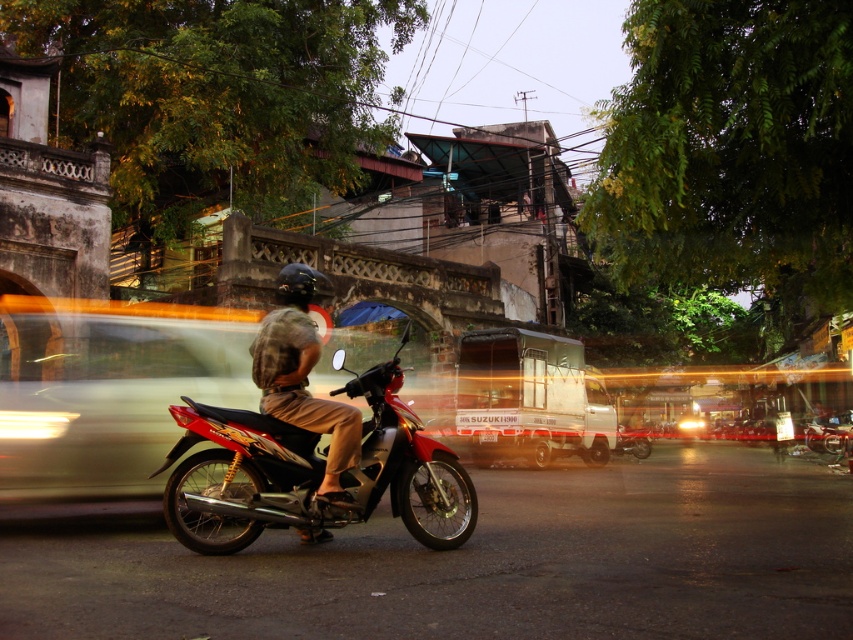
Does shiny metallic motorcycle at center appear on the left side of camouflage fabric shirt at center?

Incorrect, shiny metallic motorcycle at center is not on the left side of camouflage fabric shirt at center.

Is shiny metallic motorcycle at center shorter than camouflage fabric shirt at center?

Indeed, shiny metallic motorcycle at center has a lesser height compared to camouflage fabric shirt at center.

Image resolution: width=853 pixels, height=640 pixels. Describe the element at coordinates (312, 472) in the screenshot. I see `shiny metallic motorcycle at center` at that location.

I want to click on shiny metallic motorcycle at center, so click(312, 472).

Is point (227, 326) behind point (260, 444)?

Yes, it is.

Can you confirm if metallic silver car at left is positioned below shiny metallic motorcycle at center?

Incorrect, metallic silver car at left is not positioned below shiny metallic motorcycle at center.

Which is in front, point (157, 339) or point (363, 488)?

Positioned in front is point (363, 488).

Identify the location of metallic silver car at left. (107, 390).

Between metallic silver car at left and camouflage fabric shirt at center, which one has less height?

With less height is camouflage fabric shirt at center.

Is metallic silver car at left positioned before camouflage fabric shirt at center?

No, it is not.

Between point (15, 424) and point (276, 349), which one is positioned behind?

Point (15, 424)

The height and width of the screenshot is (640, 853). Find the location of `metallic silver car at left`. metallic silver car at left is located at coordinates (107, 390).